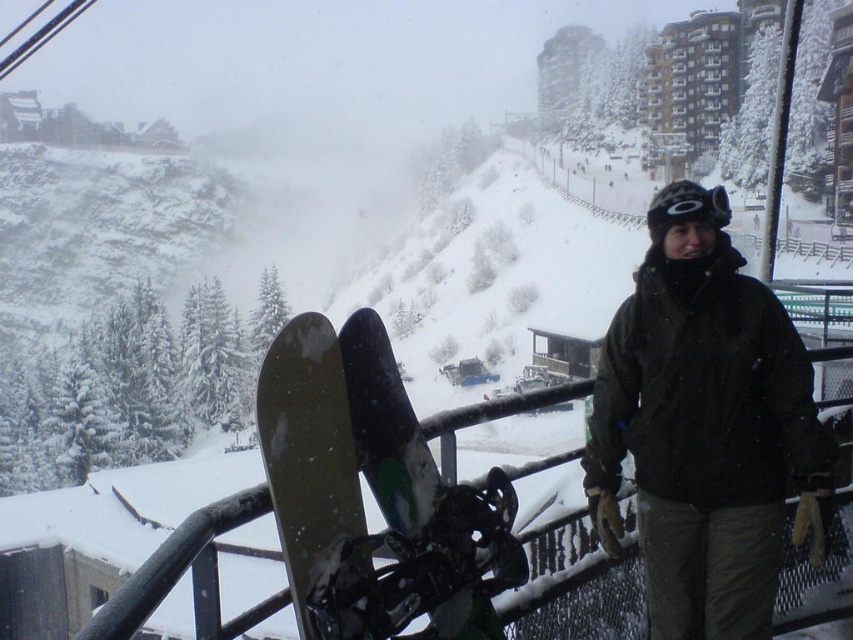
Does matte black snowboard at lower center appear under green matte snowboard at center?

No, matte black snowboard at lower center is not below green matte snowboard at center.

You are a GUI agent. You are given a task and a screenshot of the screen. Output one action in this format:
    pyautogui.click(x=<x>, y=<y>)
    Task: Click on the matte black snowboard at lower center
    This screenshot has width=853, height=640.
    Given the screenshot: What is the action you would take?
    pyautogui.click(x=309, y=451)

Which is more to the left, dark green jacket at center or black matte goggles at center?

Positioned to the left is dark green jacket at center.

The width and height of the screenshot is (853, 640). Identify the location of dark green jacket at center. (706, 436).

This screenshot has width=853, height=640. I want to click on dark green jacket at center, so click(706, 436).

I want to click on dark green jacket at center, so click(x=706, y=436).

Who is positioned more to the right, dark green jacket at center or matte black snowboard at lower center?

dark green jacket at center

Which is more to the left, dark green jacket at center or matte black snowboard at lower center?

From the viewer's perspective, matte black snowboard at lower center appears more on the left side.

Who is more forward, (x=689, y=506) or (x=300, y=624)?

Point (x=300, y=624)

The image size is (853, 640). What are the coordinates of `dark green jacket at center` in the screenshot? It's located at (706, 436).